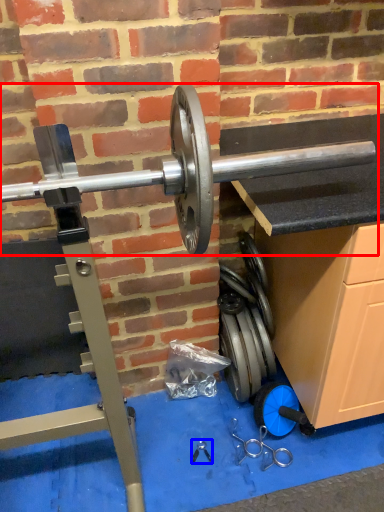
Question: Which of the following is the farthest to the observer, barbell (highlighted by a red box) or tool (highlighted by a blue box)?

Choices:
 (A) barbell
 (B) tool

Answer: (B)